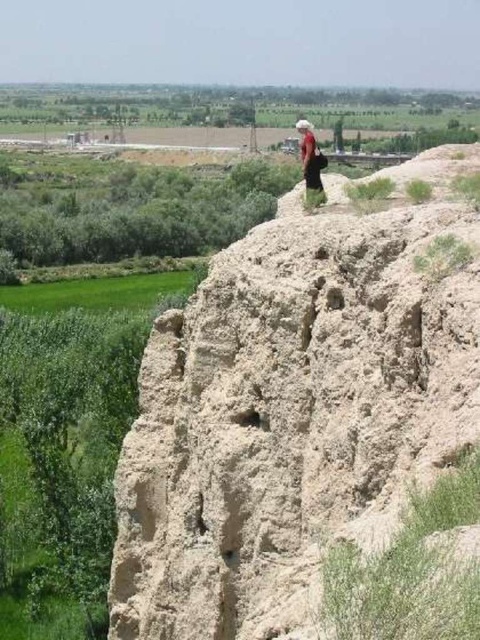
You are standing at the base of the rugged cliff and notice a point marked at coordinates (296, 410). According to the image, what specific feature does this point indicate?

The point at coordinates (296, 410) corresponds to the light beige rough rock at center, which is part of the weathered and eroded cliff face described in the scene.

You are standing on the rugged cliff and notice both the light beige rough rock at center and the matte red dress at center. Which object would you need to move closer to in order to pick up the smaller one?

The light beige rough rock at center is smaller than the matte red dress at center, so you would need to move closer to the light beige rough rock at center to pick it up.